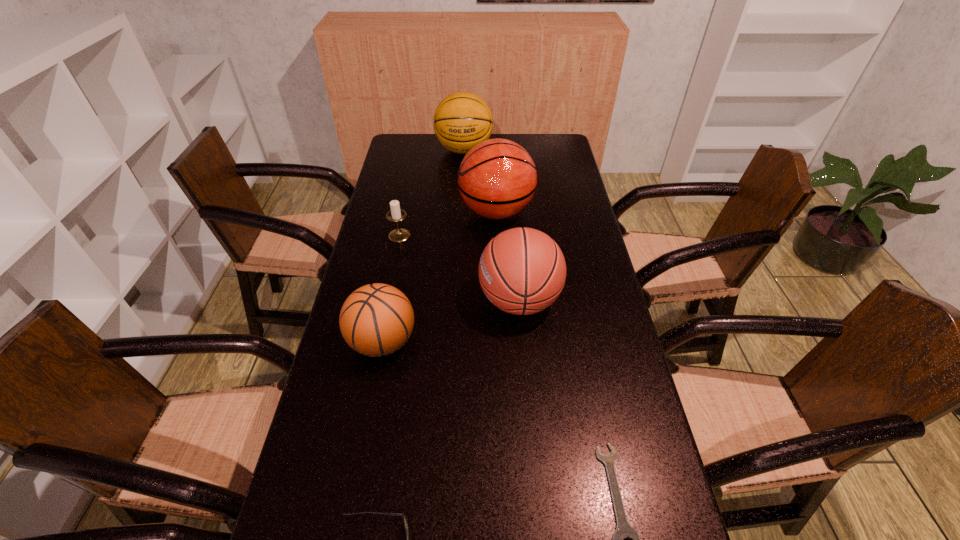
At what (x,y) coordinates should I click in order to perform the action: click on vacant space that's between the fourth tallest object and the third nearest basketball. Please return your answer as a coordinate pair (x, y). This screenshot has width=960, height=540. Looking at the image, I should click on (440, 276).

Find the location of a particular element. This screenshot has height=540, width=960. the third closest object to the fourth tallest object is located at coordinates (399, 514).

The width and height of the screenshot is (960, 540). Identify the location of object that is the sixth closest to the farthest basketball. [x=399, y=514].

Where is `the closest basketball to the farthest object`? the closest basketball to the farthest object is located at coordinates (497, 178).

Identify the location of basketball that stands as the third closest to the second farthest basketball. The height and width of the screenshot is (540, 960). (377, 319).